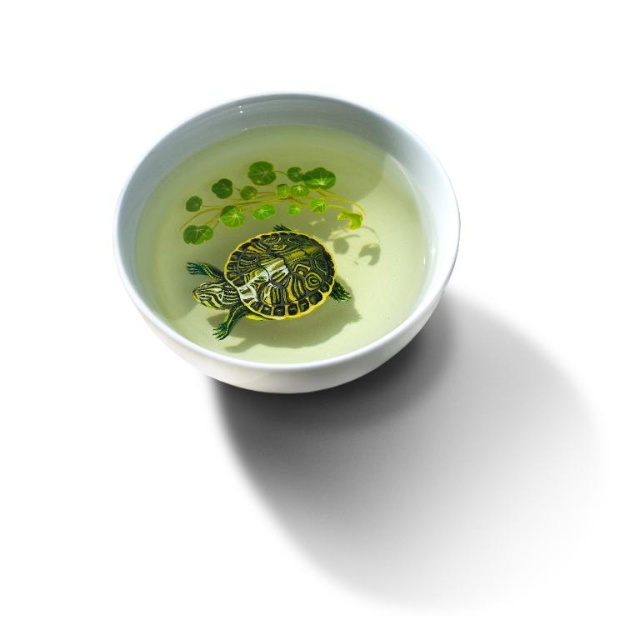
Who is higher up, white ceramic bowl at center or shiny green tortoise at center?

white ceramic bowl at center is above.

Is point (397, 339) farther from camera compared to point (308, 268)?

That is False.

Which is behind, point (435, 177) or point (250, 268)?

Positioned behind is point (250, 268).

This screenshot has height=640, width=640. I want to click on white ceramic bowl at center, so click(296, 122).